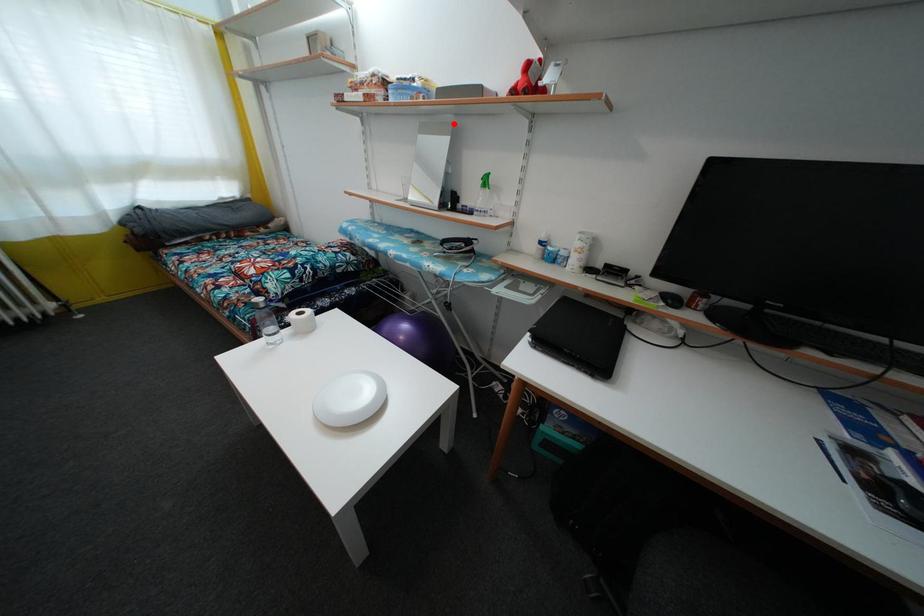
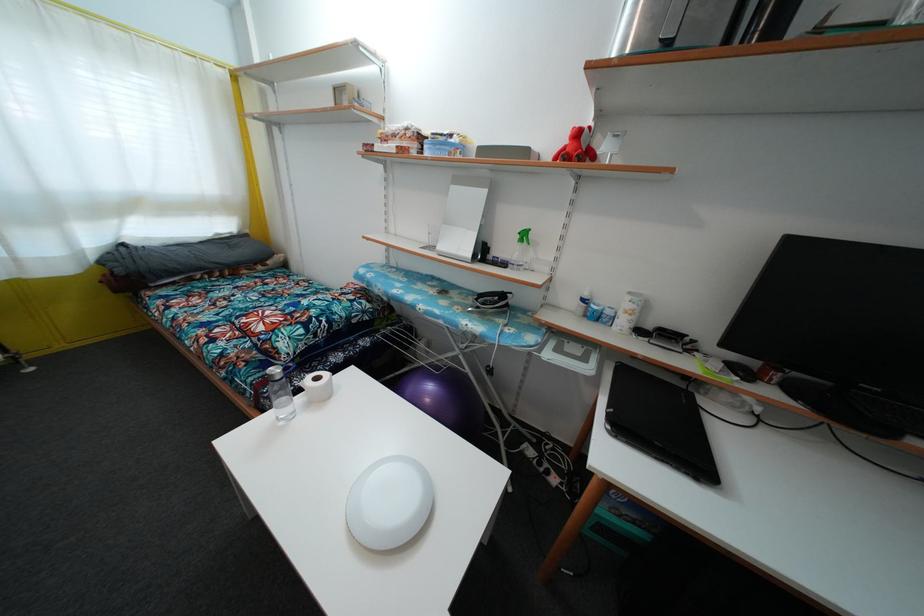
In the second image, find the point that corresponds to the highlighted location in the first image.

(488, 177)